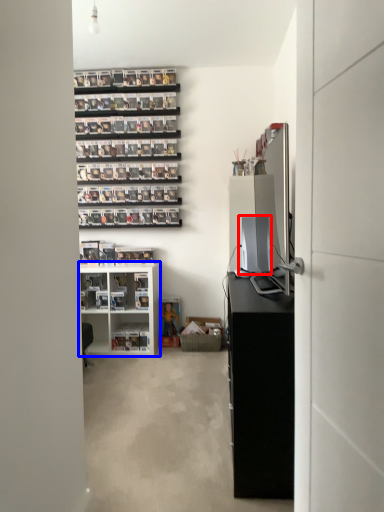
Question: Which object is further to the camera taking this photo, desktop computer (highlighted by a red box) or shelf (highlighted by a blue box)?

Choices:
 (A) desktop computer
 (B) shelf

Answer: (B)